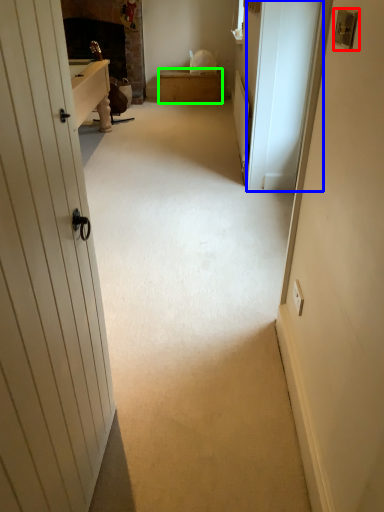
Question: Which object is positioned farthest from lock (highlighted by a red box)? Select from screen door (highlighted by a blue box) and furniture (highlighted by a green box).

Choices:
 (A) screen door
 (B) furniture

Answer: (B)